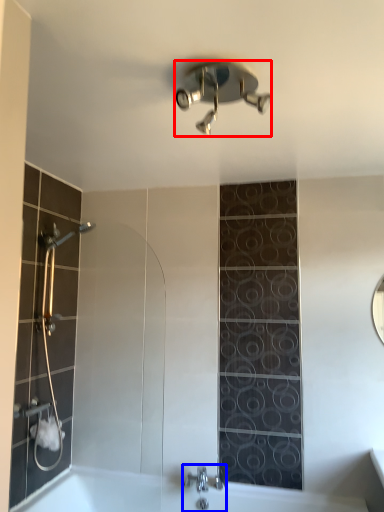
Question: Which point is closer to the camera, shower (highlighted by a red box) or tap (highlighted by a blue box)?

Choices:
 (A) shower
 (B) tap

Answer: (A)